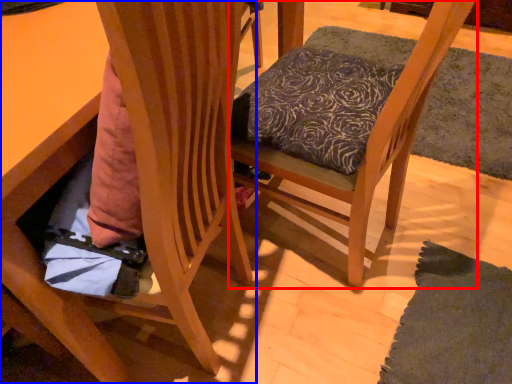
Question: Which object is closer to the camera taking this photo, chair (highlighted by a red box) or chair (highlighted by a blue box)?

Choices:
 (A) chair
 (B) chair

Answer: (B)